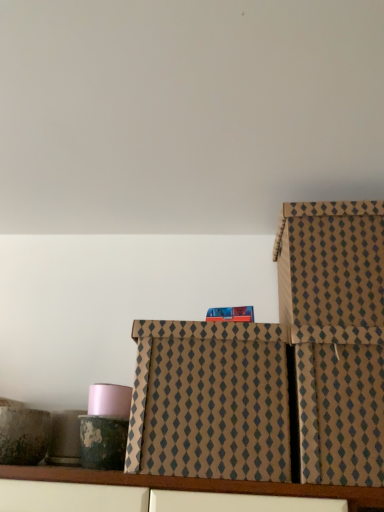
Question: Should I look upward or downward to see brown textured box at right, the first box positioned from the right?

Choices:
 (A) up
 (B) down

Answer: (B)

Question: Is brown textured box at right, the 2th box positioned from the left, behind brown textured box at center, the first box positioned from the left?

Choices:
 (A) yes
 (B) no

Answer: (B)

Question: Is brown textured box at right, the first box positioned from the right, to the right of brown textured box at center, the first box positioned from the left, from the viewer's perspective?

Choices:
 (A) yes
 (B) no

Answer: (A)

Question: From a real-world perspective, is brown textured box at right, the 2th box positioned from the left, physically below brown textured box at center, the first box positioned from the left?

Choices:
 (A) yes
 (B) no

Answer: (A)

Question: From a real-world perspective, is brown textured box at right, the first box positioned from the right, located higher than brown textured box at center, which ranks as the second box in right-to-left order?

Choices:
 (A) no
 (B) yes

Answer: (A)

Question: Can brown textured box at center, which ranks as the second box in right-to-left order, be found inside brown textured box at right, the first box positioned from the right?

Choices:
 (A) yes
 (B) no

Answer: (B)

Question: Can you confirm if brown textured box at right, the first box positioned from the right, is bigger than brown textured box at center, the first box positioned from the left?

Choices:
 (A) no
 (B) yes

Answer: (A)

Question: Does brown textured box at center, which ranks as the second box in right-to-left order, have a smaller size compared to brown textured box at right, the 2th box positioned from the left?

Choices:
 (A) no
 (B) yes

Answer: (A)

Question: Is brown textured box at center, the first box positioned from the left, positioned behind brown textured box at right, the first box positioned from the right?

Choices:
 (A) yes
 (B) no

Answer: (A)

Question: Does brown textured box at center, which ranks as the second box in right-to-left order, have a lesser height compared to brown textured box at right, the first box positioned from the right?

Choices:
 (A) yes
 (B) no

Answer: (B)

Question: Is brown textured box at center, which ranks as the second box in right-to-left order, outside of brown textured box at right, the 2th box positioned from the left?

Choices:
 (A) no
 (B) yes

Answer: (B)

Question: Is brown textured box at right, the first box positioned from the right, surrounded by brown textured box at center, the first box positioned from the left?

Choices:
 (A) yes
 (B) no

Answer: (B)

Question: From a real-world perspective, is brown textured box at center, which ranks as the second box in right-to-left order, on brown textured box at right, the first box positioned from the right?

Choices:
 (A) no
 (B) yes

Answer: (B)

Question: From the image's perspective, is brown textured box at right, the 2th box positioned from the left, positioned above or below brown textured box at center, the first box positioned from the left?

Choices:
 (A) above
 (B) below

Answer: (B)